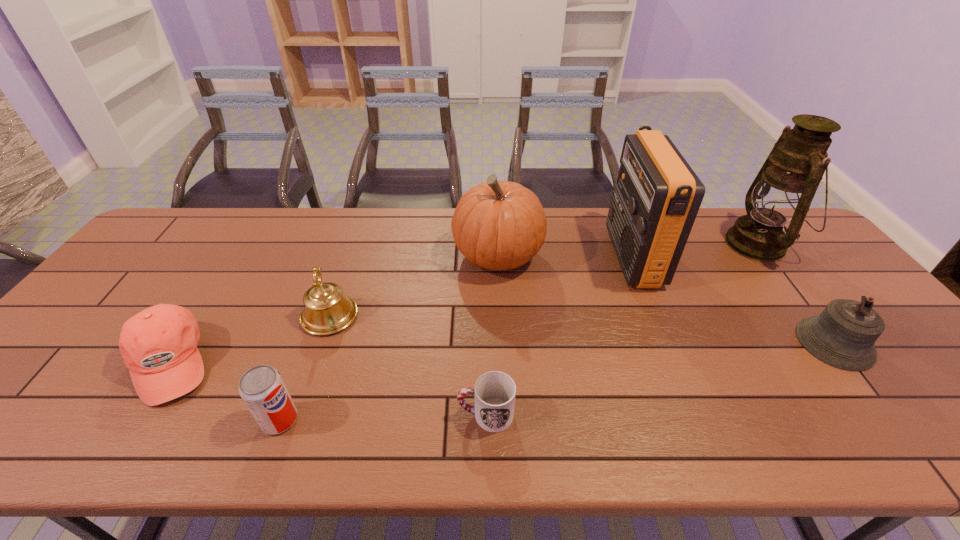
Where is `vacant space located on the front-facing side of the sixth object from left to right`? vacant space located on the front-facing side of the sixth object from left to right is located at coordinates (593, 256).

Where is `free space located on the front-facing side of the sixth object from left to right`? The image size is (960, 540). free space located on the front-facing side of the sixth object from left to right is located at coordinates pyautogui.click(x=581, y=256).

Image resolution: width=960 pixels, height=540 pixels. Find the location of `free location located 0.100m on the front-facing side of the sixth object from left to right`. free location located 0.100m on the front-facing side of the sixth object from left to right is located at coordinates (581, 256).

You are a GUI agent. You are given a task and a screenshot of the screen. Output one action in this format:
    pyautogui.click(x=<x>, y=<y>)
    Task: Click on the free space located 0.380m on the stem of the pumpkin
    Image resolution: width=960 pixels, height=540 pixels.
    Given the screenshot: What is the action you would take?
    pyautogui.click(x=329, y=255)

Locate an element on the screen. The width and height of the screenshot is (960, 540). vacant space positioned 0.250m on the stem of the pumpkin is located at coordinates (372, 255).

The image size is (960, 540). I want to click on free space located 0.330m on the stem of the pumpkin, so click(x=346, y=255).

Find the location of `vacant point located on the right of the left bell`. vacant point located on the right of the left bell is located at coordinates (509, 316).

Identify the location of free location located on the left of the right bell. (735, 343).

Where is `vacant space positioned 0.240m on the right of the soda`? The width and height of the screenshot is (960, 540). vacant space positioned 0.240m on the right of the soda is located at coordinates (410, 420).

Find the location of a particular element. Image resolution: width=960 pixels, height=540 pixels. vacant space located on the right of the baseball cap is located at coordinates (311, 363).